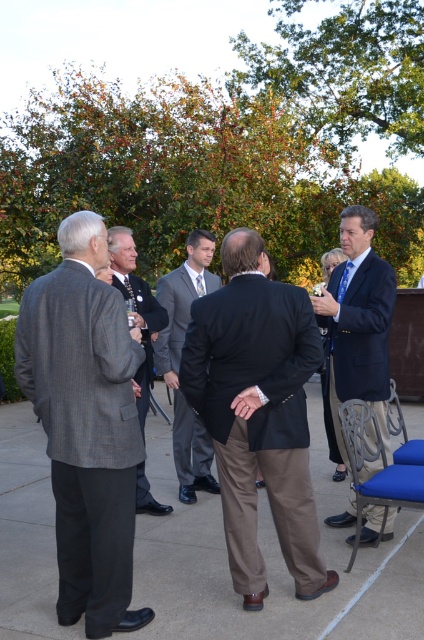
You are a photographer at this event and need to position two subjects, the dark brown suit at center and the gray wool suit at center, for a group photo. Based on their current positions, which subject is wider and should be placed on the outer edge to balance the composition?

The dark brown suit at center might be wider than the gray wool suit at center, so it should be placed on the outer edge to balance the composition.

You are organizing a photo shoot and need to arrange the gray wool suit at left and the dark blue suit at center in a row. Based on their sizes, which suit should be placed first if you want the larger one to be in the middle?

The dark blue suit at center should be placed first because it occupies more space than the gray wool suit at left, ensuring it can be positioned centrally.

You are a photographer at this event and need to position two subjects for a photo. You have the gray wool suit at left and the dark blue suit at center. Which subject should stand closer to the camera to ensure both appear the same height in the photo?

The gray wool suit at left is much taller than the dark blue suit at center, so the dark blue suit at center should stand closer to the camera to balance their apparent heights.